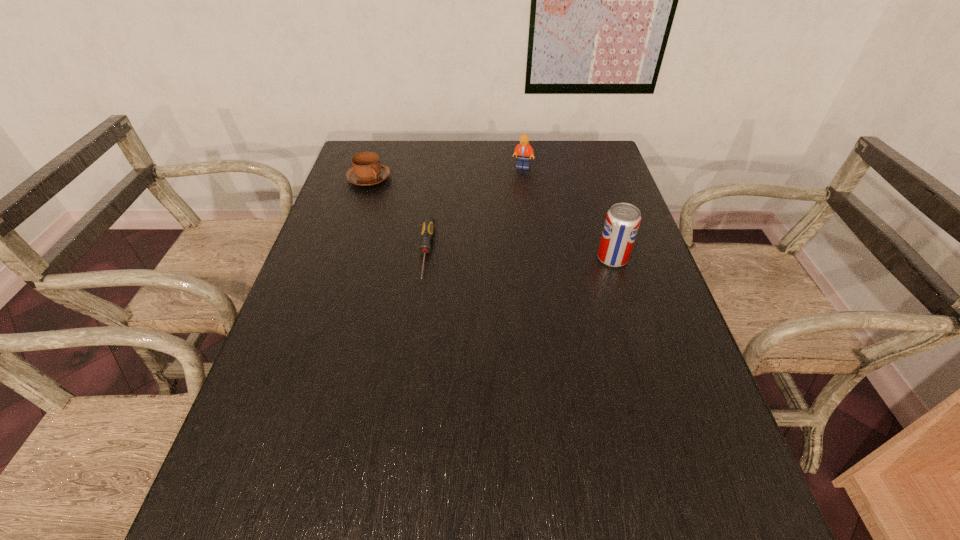
What are the coordinates of `object present at the far left corner` in the screenshot? It's located at (366, 170).

Locate an element on the screen. The image size is (960, 540). vacant space at the far edge is located at coordinates (404, 174).

In the image, there is a desktop. Where is `vacant region at the near edge`? vacant region at the near edge is located at coordinates (444, 438).

Locate an element on the screen. This screenshot has width=960, height=540. free region at the left edge is located at coordinates (364, 222).

Image resolution: width=960 pixels, height=540 pixels. In the image, there is a desktop. Identify the location of vacant space at the right edge. (598, 201).

Locate an element on the screen. This screenshot has width=960, height=540. blank space at the far right corner of the desktop is located at coordinates (591, 151).

Where is `vacant area that lies between the second object from left to right and the soda`? vacant area that lies between the second object from left to right and the soda is located at coordinates (519, 255).

Where is `blank region between the shortest object and the third shortest object`? blank region between the shortest object and the third shortest object is located at coordinates (474, 210).

This screenshot has height=540, width=960. In order to click on free space between the third tallest object and the tallest object in this screenshot , I will do `click(491, 218)`.

Locate an element on the screen. The width and height of the screenshot is (960, 540). free space that is in between the second object from left to right and the cappuccino is located at coordinates 397,215.